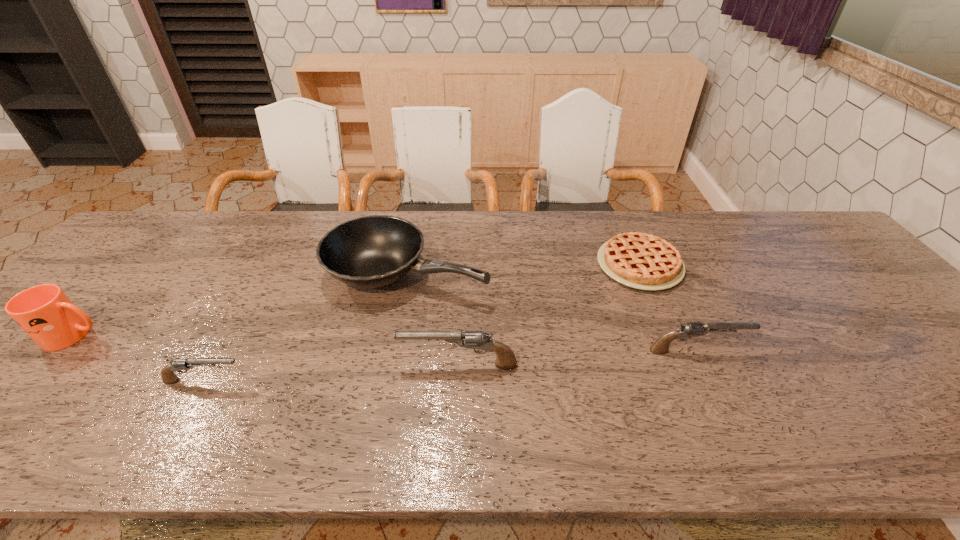
Where is `the second object from left to right`? This screenshot has height=540, width=960. the second object from left to right is located at coordinates (168, 376).

This screenshot has height=540, width=960. Find the location of `the fifth tallest object`. the fifth tallest object is located at coordinates (168, 376).

Identify the location of the second nearest gun. This screenshot has height=540, width=960. click(x=506, y=360).

What are the coordinates of `the tallest gun` in the screenshot? It's located at (506, 360).

The image size is (960, 540). What are the coordinates of `the fourth tallest object` in the screenshot? It's located at (690, 329).

Where is `the farthest gun`? The image size is (960, 540). the farthest gun is located at coordinates (690, 329).

You are a GUI agent. You are given a task and a screenshot of the screen. Output one action in this format:
    pyautogui.click(x=<x>, y=<y>)
    Task: Click on the pie
    The width and height of the screenshot is (960, 540).
    Given the screenshot: What is the action you would take?
    pyautogui.click(x=643, y=261)

Find the location of a particular element. mug is located at coordinates (44, 312).

Where is `frying pan`? The width and height of the screenshot is (960, 540). frying pan is located at coordinates (368, 252).

Find the location of `free space located aiming along the barrel of the leftmost gun`. free space located aiming along the barrel of the leftmost gun is located at coordinates (424, 381).